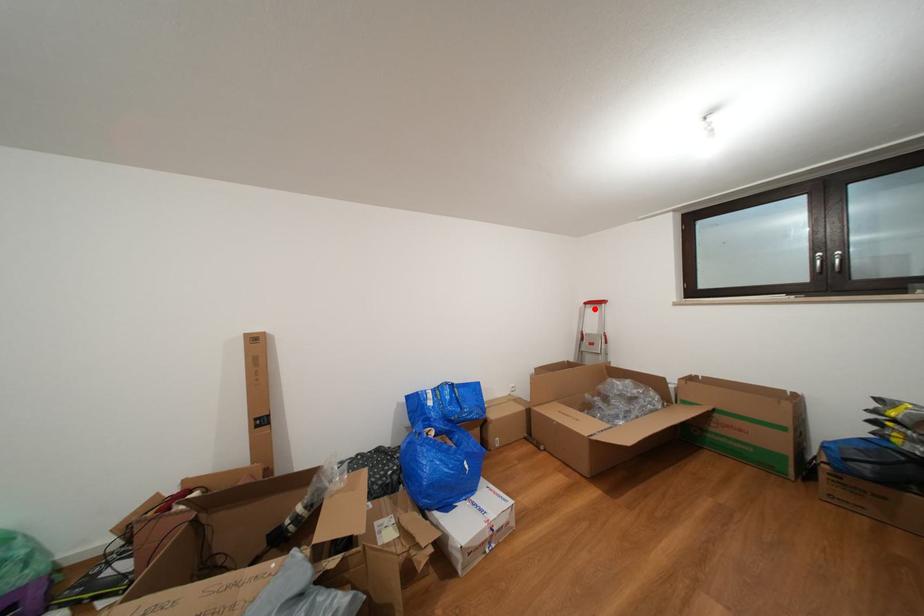
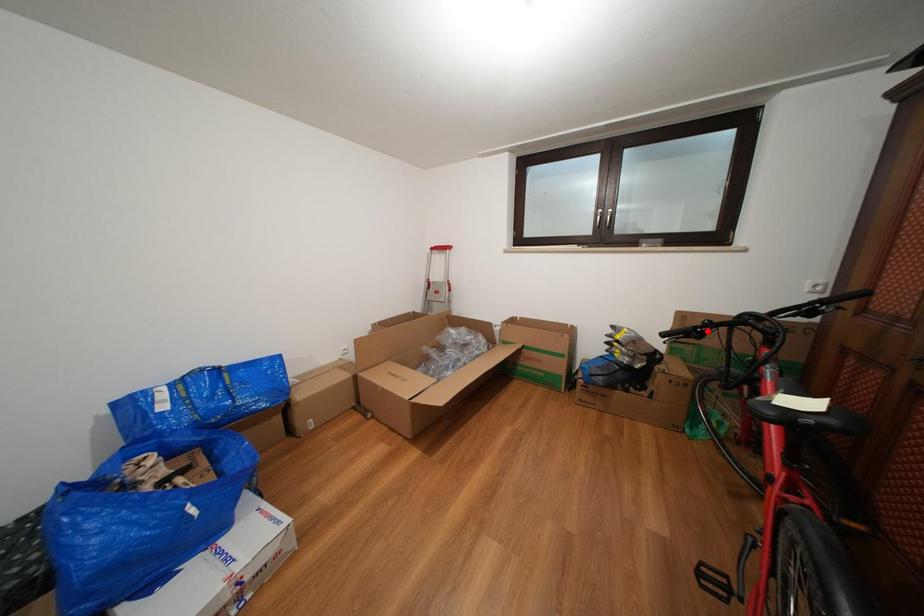
I am providing you with two images of the same scene from different viewpoints. A red point is marked on the first image and another point is marked on the second image. Do the highlighted points in image1 and image2 indicate the same real-world spot?

No